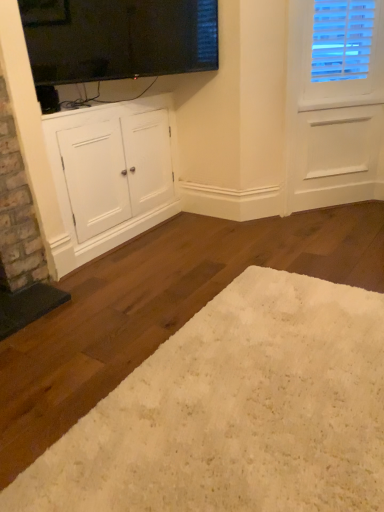
Question: Does black glass window screen at upper center come behind white matte cabinet at lower left?

Choices:
 (A) yes
 (B) no

Answer: (B)

Question: Can you confirm if black glass window screen at upper center is bigger than white matte cabinet at lower left?

Choices:
 (A) no
 (B) yes

Answer: (A)

Question: Are black glass window screen at upper center and white matte cabinet at lower left making contact?

Choices:
 (A) yes
 (B) no

Answer: (B)

Question: Can you confirm if black glass window screen at upper center is positioned to the left of white matte cabinet at lower left?

Choices:
 (A) no
 (B) yes

Answer: (A)

Question: From the image's perspective, is black glass window screen at upper center located beneath white matte cabinet at lower left?

Choices:
 (A) yes
 (B) no

Answer: (B)

Question: From a real-world perspective, is black glass window screen at upper center positioned under white matte cabinet at lower left based on gravity?

Choices:
 (A) no
 (B) yes

Answer: (A)

Question: Is white shag rug at lower center further to camera compared to white matte cabinet at lower left?

Choices:
 (A) yes
 (B) no

Answer: (B)

Question: Could you tell me if white shag rug at lower center is turned towards white matte cabinet at lower left?

Choices:
 (A) yes
 (B) no

Answer: (B)

Question: Can you confirm if white shag rug at lower center is thinner than white matte cabinet at lower left?

Choices:
 (A) yes
 (B) no

Answer: (B)

Question: Is white shag rug at lower center closer to the viewer compared to white matte cabinet at lower left?

Choices:
 (A) yes
 (B) no

Answer: (A)

Question: Does white shag rug at lower center have a larger size compared to white matte cabinet at lower left?

Choices:
 (A) no
 (B) yes

Answer: (A)

Question: Is white shag rug at lower center with white matte cabinet at lower left?

Choices:
 (A) no
 (B) yes

Answer: (A)

Question: From a real-world perspective, is white matte cabinet at lower left physically above white shag rug at lower center?

Choices:
 (A) yes
 (B) no

Answer: (A)